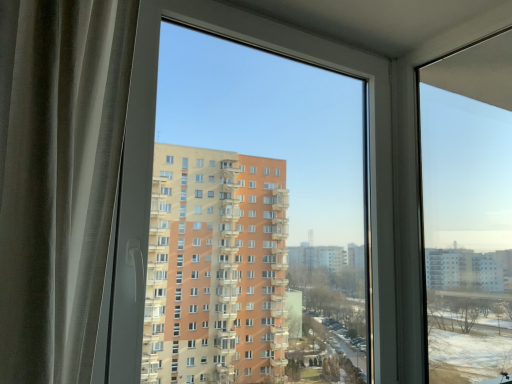
Describe the element at coordinates (254, 218) in the screenshot. Image resolution: width=512 pixels, height=384 pixels. I see `transparent plastic window at center` at that location.

Locate an element on the screen. The image size is (512, 384). transparent plastic window at center is located at coordinates (254, 218).

You are a GUI agent. You are given a task and a screenshot of the screen. Output one action in this format:
    pyautogui.click(x=<x>, y=<y>)
    Task: Click on the transparent glass window at right
    The image size is (512, 384).
    Given the screenshot: What is the action you would take?
    pyautogui.click(x=468, y=211)

Describe the element at coordinates (468, 211) in the screenshot. I see `transparent glass window at right` at that location.

Where is `transparent plastic window at center`? This screenshot has width=512, height=384. transparent plastic window at center is located at coordinates (254, 218).

Is transparent plastic window at center to the left of transparent glass window at right from the viewer's perspective?

Yes.

Is transparent plastic window at center positioned before transparent glass window at right?

Yes, transparent plastic window at center is closer to the viewer.

Considering the points (187, 41) and (500, 276), which point is behind, point (187, 41) or point (500, 276)?

The point (187, 41) is farther from the camera.

From the image's perspective, which is below, transparent plastic window at center or transparent glass window at right?

From the image's view, transparent glass window at right is below.

From a real-world perspective, is transparent plastic window at center positioned under transparent glass window at right based on gravity?

Yes, from a real-world perspective, transparent plastic window at center is below transparent glass window at right.

Does transparent plastic window at center have a lesser width compared to transparent glass window at right?

Correct, the width of transparent plastic window at center is less than that of transparent glass window at right.

Considering the sizes of objects transparent plastic window at center and transparent glass window at right in the image provided, who is shorter, transparent plastic window at center or transparent glass window at right?

transparent glass window at right.

Considering the sizes of objects transparent plastic window at center and transparent glass window at right in the image provided, who is smaller, transparent plastic window at center or transparent glass window at right?

With smaller size is transparent glass window at right.

Is transparent plastic window at center surrounding transparent glass window at right?

That's incorrect, transparent glass window at right is not inside transparent plastic window at center.

Are transparent plastic window at center and transparent glass window at right beside each other?

No, transparent plastic window at center is not beside transparent glass window at right.

Does transparent plastic window at center turn towards transparent glass window at right?

Yes, transparent plastic window at center is facing transparent glass window at right.

What's the angular difference between transparent plastic window at center and transparent glass window at right's facing directions?

transparent plastic window at center and transparent glass window at right are facing 90 degrees away from each other.

The width and height of the screenshot is (512, 384). What are the coordinates of `window screen in front of the transparent glass window at right` in the screenshot? It's located at (254, 218).

In the image, is transparent glass window at right on the left side or the right side of transparent plastic window at center?

Based on their positions, transparent glass window at right is located to the right of transparent plastic window at center.

From the picture: Is transparent glass window at right closer to the viewer compared to transparent plastic window at center?

No, transparent glass window at right is further to the viewer.

Does point (460, 251) come in front of point (321, 204)?

Yes, point (460, 251) is closer to viewer.

From the image's perspective, which is below, transparent glass window at right or transparent plastic window at center?

From the image's view, transparent glass window at right is below.

From a real-world perspective, is transparent glass window at right under transparent plastic window at center?

No.

Considering the sizes of objects transparent glass window at right and transparent plastic window at center in the image provided, who is wider, transparent glass window at right or transparent plastic window at center?

transparent glass window at right.

Who is shorter, transparent glass window at right or transparent plastic window at center?

Standing shorter between the two is transparent glass window at right.

Who is bigger, transparent glass window at right or transparent plastic window at center?

transparent plastic window at center is bigger.

Is transparent glass window at right located outside transparent plastic window at center?

transparent glass window at right is positioned outside transparent plastic window at center.

Is transparent glass window at right far away from transparent plastic window at center?

That's not correct — transparent glass window at right is a little close to transparent plastic window at center.

Is transparent glass window at right facing towards transparent plastic window at center?

Yes, transparent glass window at right is aimed at transparent plastic window at center.

How many degrees apart are the facing directions of transparent glass window at right and transparent plastic window at center?

90 degrees.

Locate an element on the screen. Image resolution: width=512 pixels, height=384 pixels. window on the right side of transparent plastic window at center is located at coordinates pyautogui.click(x=468, y=211).

Identify the location of window to the right of transparent plastic window at center. (468, 211).

Where is `window screen in front of the transparent glass window at right`? Image resolution: width=512 pixels, height=384 pixels. window screen in front of the transparent glass window at right is located at coordinates (254, 218).